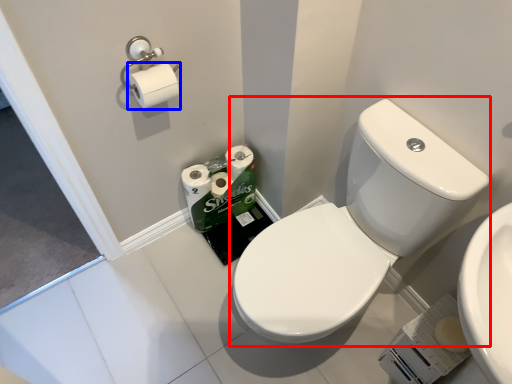
Question: Which object is further to the camera taking this photo, sink (highlighted by a red box) or toilet paper (highlighted by a blue box)?

Choices:
 (A) sink
 (B) toilet paper

Answer: (B)